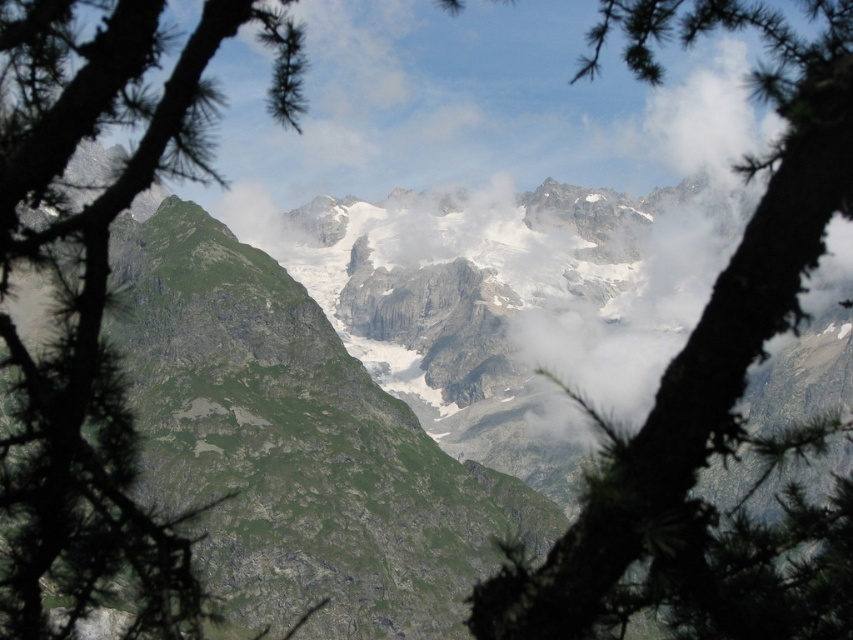
Question: Does green textured branch at center lie behind green needle-like branches at left?

Choices:
 (A) yes
 (B) no

Answer: (B)

Question: Which point is farther to the camera?

Choices:
 (A) (770, 548)
 (B) (100, 371)

Answer: (B)

Question: Which of the following is the farthest from the observer?

Choices:
 (A) [x=585, y=506]
 (B) [x=27, y=561]

Answer: (B)

Question: Among these points, which one is nearest to the camera?

Choices:
 (A) (799, 106)
 (B) (135, 580)

Answer: (B)

Question: Is green textured branch at center in front of green needle-like branches at left?

Choices:
 (A) yes
 (B) no

Answer: (A)

Question: Is the position of green textured branch at center less distant than that of green needle-like branches at left?

Choices:
 (A) no
 (B) yes

Answer: (B)